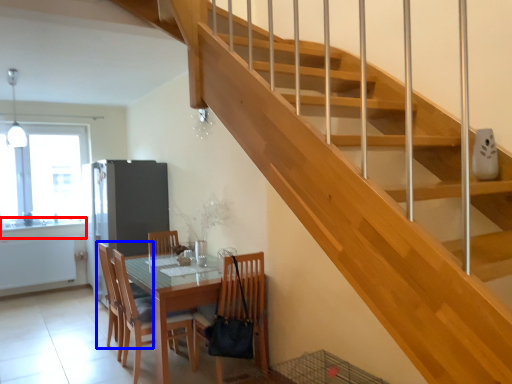
Question: Which object is further to the camera taking this photo, counter top (highlighted by a red box) or chair (highlighted by a blue box)?

Choices:
 (A) counter top
 (B) chair

Answer: (A)